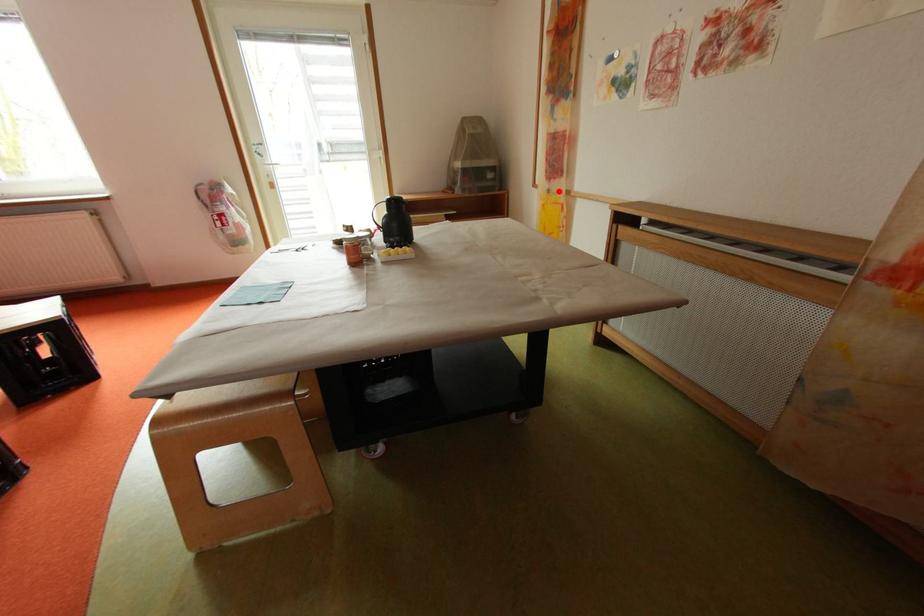
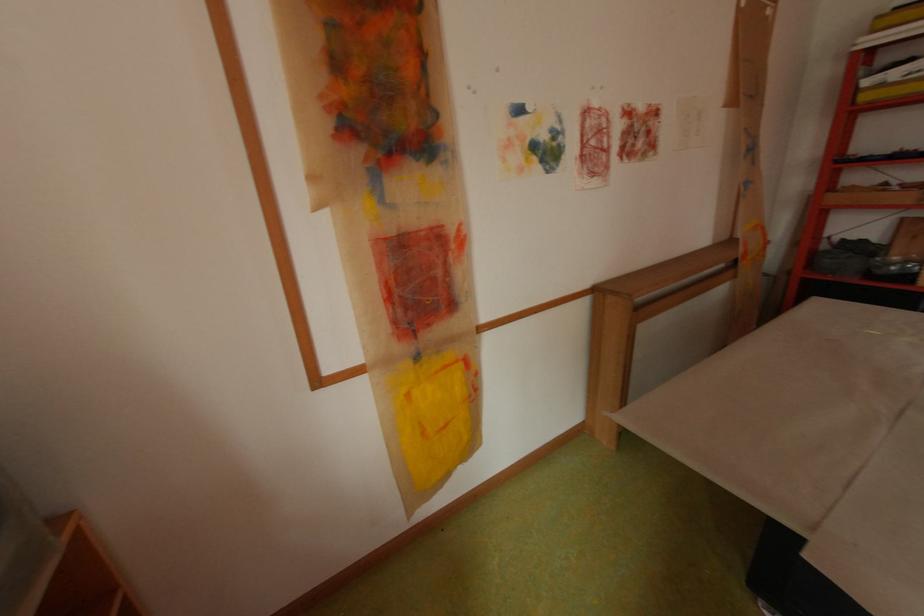
Where in the second image is the point corresponding to the highlighted location from the first image?

(429, 358)